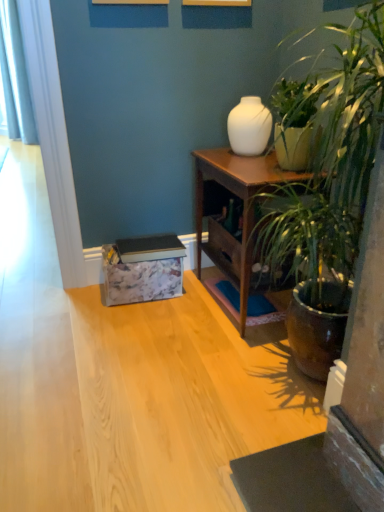
You are a GUI agent. You are given a task and a screenshot of the screen. Output one action in this format:
    pyautogui.click(x=<x>, y=<y>)
    Task: Click on the vacant region to the left of wooden nightstand at center-right
    This screenshot has width=384, height=512.
    Given the screenshot: What is the action you would take?
    pyautogui.click(x=165, y=319)